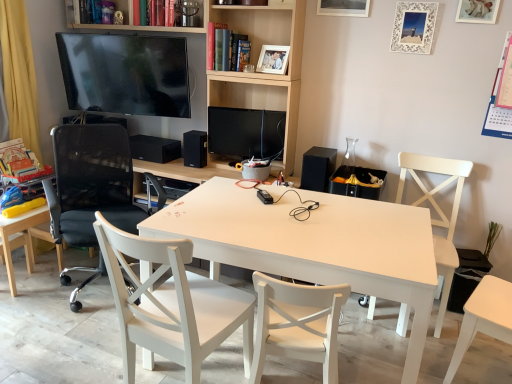
Question: Would you say hardcover book at upper center, which is the 1th book in top-to-bottom order, is outside black mesh office chair at left?

Choices:
 (A) no
 (B) yes

Answer: (B)

Question: Is hardcover book at upper center, the 2th book when ordered from bottom to top, positioned with its back to black mesh office chair at left?

Choices:
 (A) yes
 (B) no

Answer: (B)

Question: Can you confirm if hardcover book at upper center, which is the 1th book in top-to-bottom order, is positioned to the right of black mesh office chair at left?

Choices:
 (A) no
 (B) yes

Answer: (B)

Question: From the image's perspective, is hardcover book at upper center, the 2th book when ordered from bottom to top, over black mesh office chair at left?

Choices:
 (A) no
 (B) yes

Answer: (B)

Question: From a real-world perspective, does hardcover book at upper center, placed as the 1th book when sorted from left to right, sit lower than black mesh office chair at left?

Choices:
 (A) yes
 (B) no

Answer: (B)

Question: Is hardcover book at upper center, the 2th book when ordered from bottom to top, in front of black mesh office chair at left?

Choices:
 (A) no
 (B) yes

Answer: (A)

Question: Is white wood chair at center, arranged as the 3th chair when viewed from the right, positioned in front of hardcover book at upper center, arranged as the first book when ordered from the bottom?

Choices:
 (A) no
 (B) yes

Answer: (B)

Question: Is hardcover book at upper center, which is the first book from right to left, a part of white wood chair at center, the 3th chair viewed from the left?

Choices:
 (A) yes
 (B) no

Answer: (B)

Question: From a real-world perspective, is white wood chair at center, the 3th chair viewed from the left, under hardcover book at upper center, which is the first book from right to left?

Choices:
 (A) yes
 (B) no

Answer: (A)

Question: Would you consider white wood chair at center, the 3th chair viewed from the left, to be distant from hardcover book at upper center, which is the first book from right to left?

Choices:
 (A) yes
 (B) no

Answer: (A)

Question: Does white wood chair at center, arranged as the 3th chair when viewed from the right, have a greater height compared to hardcover book at upper center, the second book positioned from the left?

Choices:
 (A) yes
 (B) no

Answer: (A)

Question: Is white wood chair at center, arranged as the 3th chair when viewed from the right, positioned with its back to hardcover book at upper center, which is the second book from top to bottom?

Choices:
 (A) yes
 (B) no

Answer: (B)

Question: Is black matte speaker at upper right, which is the third speaker in back-to-front order, behind yellow fabric chair at left, the 5th chair when ordered from right to left?

Choices:
 (A) yes
 (B) no

Answer: (A)